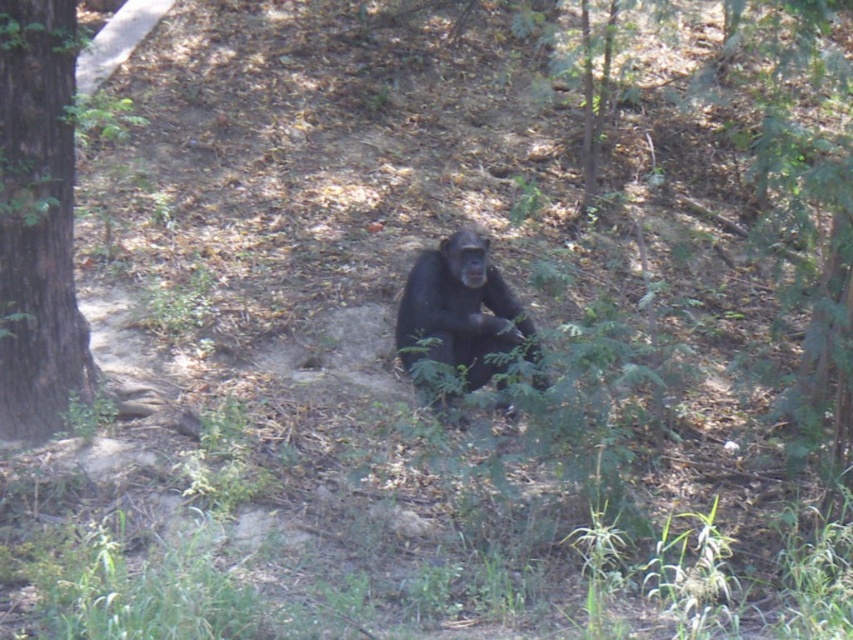
You are a photographer trying to capture a clear photo of the black fur monkey at center. However, the brown rough tree at left is blocking your view. Can you move to the side to get a clear shot without the tree in the way?

The brown rough tree at left is in front of the black fur monkey at center, so moving to the side might allow you to position yourself where the tree no longer blocks the view of the monkey.

From the picture: You are standing in the forest where the chimpanzee is sitting. There are two points marked in the image, point A at coordinates point[53,310] and point B at coordinates point[413,333]. Which point is closer to you?

Point A at coordinates point[53,310] is closer to the viewer than point B at coordinates point[413,333].

You are standing at the center of the image. Which direction should you look to see the brown rough tree at left?

The brown rough tree at left is located at point 0.347 on the x and 0.046 on the y coordinates, so you should look to the left side of the image.